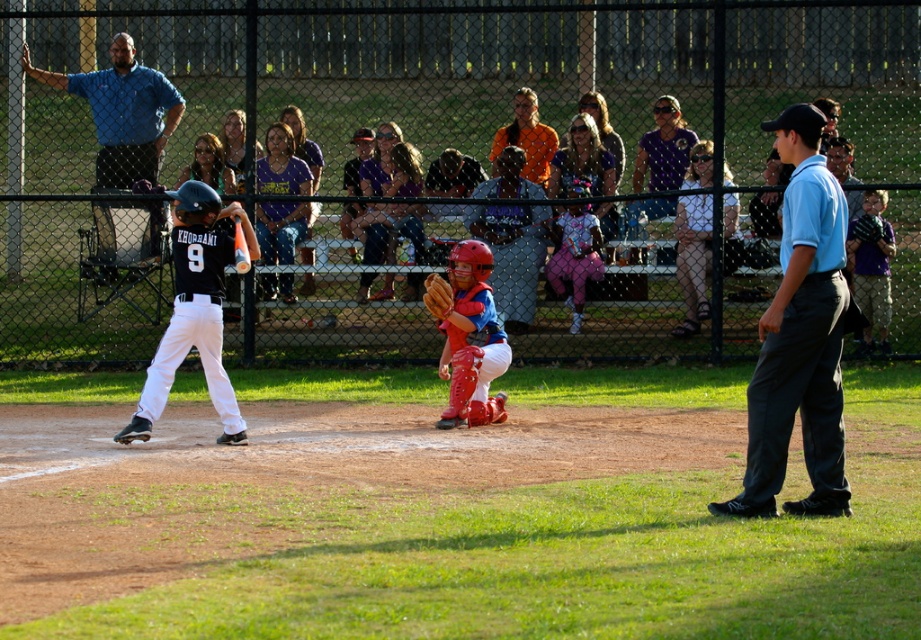
Question: Which point appears farthest from the camera in this image?

Choices:
 (A) (191, 195)
 (B) (241, 234)

Answer: (B)

Question: Is the position of light blue shirt at right less distant than that of orange matte bat at center?

Choices:
 (A) no
 (B) yes

Answer: (B)

Question: Does brown leather glove at center appear on the right side of orange matte baseball at center?

Choices:
 (A) yes
 (B) no

Answer: (A)

Question: Which is nearer to the light blue shirt at right?

Choices:
 (A) blue shirt at upper left
 (B) orange matte baseball at center

Answer: (B)

Question: Can you confirm if blue shirt at upper left is positioned below orange matte baseball at center?

Choices:
 (A) no
 (B) yes

Answer: (A)

Question: Which of these objects is positioned farthest from the red matte catcher at center?

Choices:
 (A) striped cotton shirt at right
 (B) light blue shirt at right

Answer: (A)